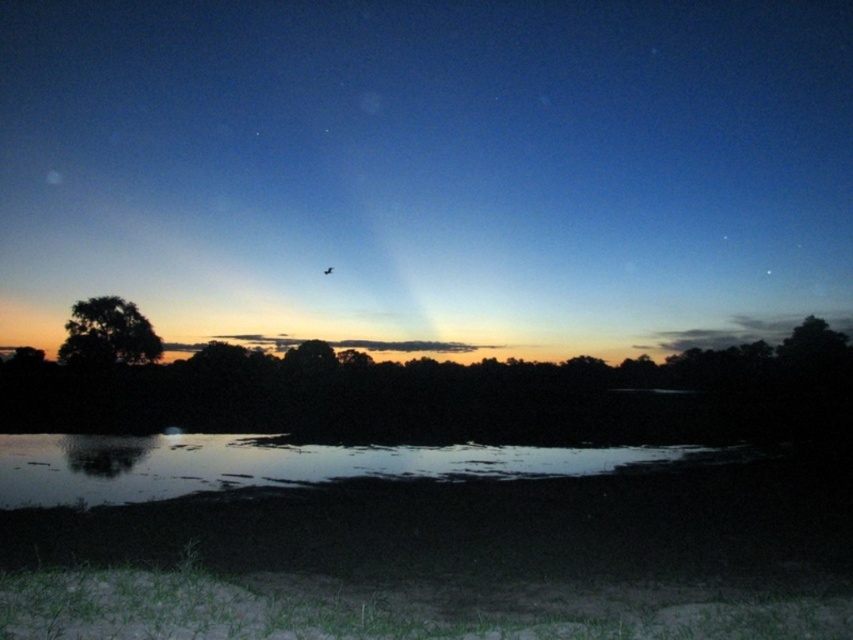
Does point (608, 68) come closer to viewer compared to point (144, 339)?

No.

Is silky blue sky at center to the left of green leafy tree at left from the viewer's perspective?

Incorrect, silky blue sky at center is not on the left side of green leafy tree at left.

Find the location of a particular element. The height and width of the screenshot is (640, 853). silky blue sky at center is located at coordinates coord(428,170).

Looking at this image, can you confirm if glossy reflective water at center is positioned to the right of green leafy tree at left?

Correct, you'll find glossy reflective water at center to the right of green leafy tree at left.

Does glossy reflective water at center have a greater height compared to green leafy tree at left?

Incorrect, glossy reflective water at center's height is not larger of green leafy tree at left's.

The width and height of the screenshot is (853, 640). What do you see at coordinates (270, 465) in the screenshot?
I see `glossy reflective water at center` at bounding box center [270, 465].

The image size is (853, 640). What are the coordinates of `glossy reflective water at center` in the screenshot? It's located at (270, 465).

Between silky blue sky at center and glossy reflective water at center, which one is positioned lower?

glossy reflective water at center

Is silky blue sky at center shorter than glossy reflective water at center?

No, silky blue sky at center is not shorter than glossy reflective water at center.

Describe the element at coordinates (428, 170) in the screenshot. The width and height of the screenshot is (853, 640). I see `silky blue sky at center` at that location.

In order to click on silky blue sky at center in this screenshot , I will do `click(428, 170)`.